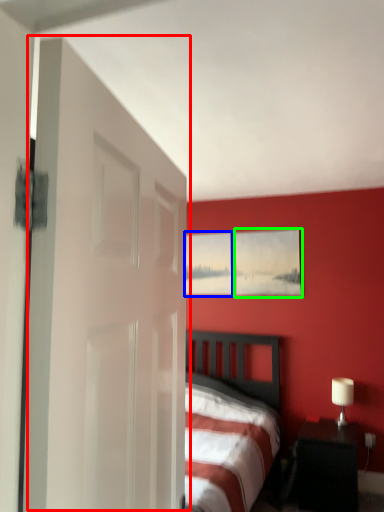
Question: Based on their relative distances, which object is farther from door (highlighted by a red box)? Choose from picture frame (highlighted by a blue box) and picture frame (highlighted by a green box).

Choices:
 (A) picture frame
 (B) picture frame

Answer: (A)